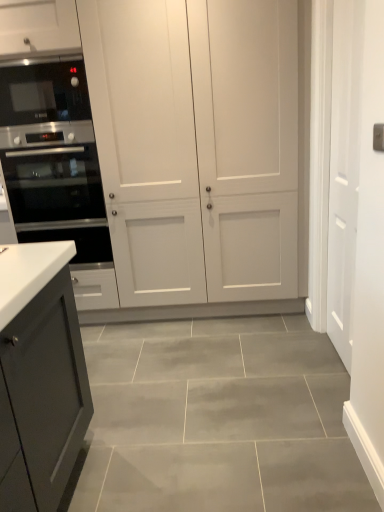
Question: Does black glass microwave at left lie behind white matte cabinet at center?

Choices:
 (A) no
 (B) yes

Answer: (B)

Question: Is the position of black glass microwave at left less distant than that of white matte cabinet at center?

Choices:
 (A) no
 (B) yes

Answer: (A)

Question: Is black glass microwave at left not near white matte cabinet at center?

Choices:
 (A) yes
 (B) no

Answer: (B)

Question: Can you confirm if black glass microwave at left is wider than white matte cabinet at center?

Choices:
 (A) no
 (B) yes

Answer: (A)

Question: From the image's perspective, would you say black glass microwave at left is positioned over white matte cabinet at center?

Choices:
 (A) no
 (B) yes

Answer: (B)

Question: Is point (62, 59) closer or farther from the camera than point (8, 188)?

Choices:
 (A) farther
 (B) closer

Answer: (B)

Question: In the image, is black glass microwave at left positioned in front of or behind satin black oven at left?

Choices:
 (A) front
 (B) behind

Answer: (A)

Question: Looking at their shapes, would you say black glass microwave at left is wider or thinner than satin black oven at left?

Choices:
 (A) thin
 (B) wide

Answer: (A)

Question: In terms of height, does black glass microwave at left look taller or shorter compared to satin black oven at left?

Choices:
 (A) short
 (B) tall

Answer: (A)

Question: Is white matte door at right wider or thinner than white matte cabinet at center?

Choices:
 (A) thin
 (B) wide

Answer: (A)

Question: Is point (344, 41) closer or farther from the camera than point (114, 212)?

Choices:
 (A) farther
 (B) closer

Answer: (B)

Question: Considering the positions of white matte door at right and white matte cabinet at center in the image, is white matte door at right taller or shorter than white matte cabinet at center?

Choices:
 (A) short
 (B) tall

Answer: (A)

Question: From the image's perspective, is white matte door at right above or below white matte cabinet at center?

Choices:
 (A) below
 (B) above

Answer: (A)

Question: Is black glass microwave at left taller or shorter than white matte door at right?

Choices:
 (A) tall
 (B) short

Answer: (B)

Question: From a real-world perspective, relative to white matte door at right, is black glass microwave at left vertically above or below?

Choices:
 (A) below
 (B) above

Answer: (B)